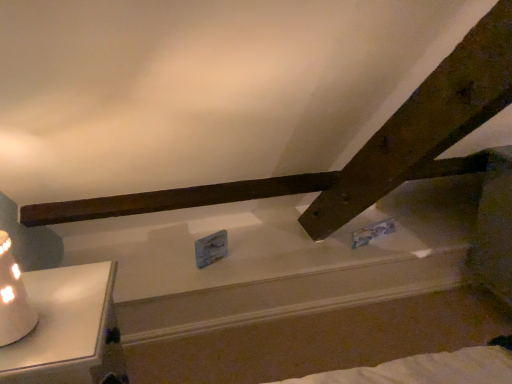
Question: Is white ceramic table lamp at lower left inside the boundaries of white glossy candlestick at lower left, or outside?

Choices:
 (A) outside
 (B) inside

Answer: (A)

Question: Considering their positions, is white ceramic table lamp at lower left located in front of or behind white glossy candlestick at lower left?

Choices:
 (A) front
 (B) behind

Answer: (A)

Question: Looking at the image, does white ceramic table lamp at lower left seem bigger or smaller compared to white glossy candlestick at lower left?

Choices:
 (A) big
 (B) small

Answer: (B)

Question: Visually, is white glossy candlestick at lower left positioned to the left or to the right of white ceramic table lamp at lower left?

Choices:
 (A) right
 (B) left

Answer: (A)

Question: From a real-world perspective, is white glossy candlestick at lower left physically located above or below white ceramic table lamp at lower left?

Choices:
 (A) above
 (B) below

Answer: (B)

Question: Is white glossy candlestick at lower left situated inside white ceramic table lamp at lower left or outside?

Choices:
 (A) outside
 (B) inside

Answer: (A)

Question: Is white glossy candlestick at lower left taller or shorter than white ceramic table lamp at lower left?

Choices:
 (A) short
 (B) tall

Answer: (B)